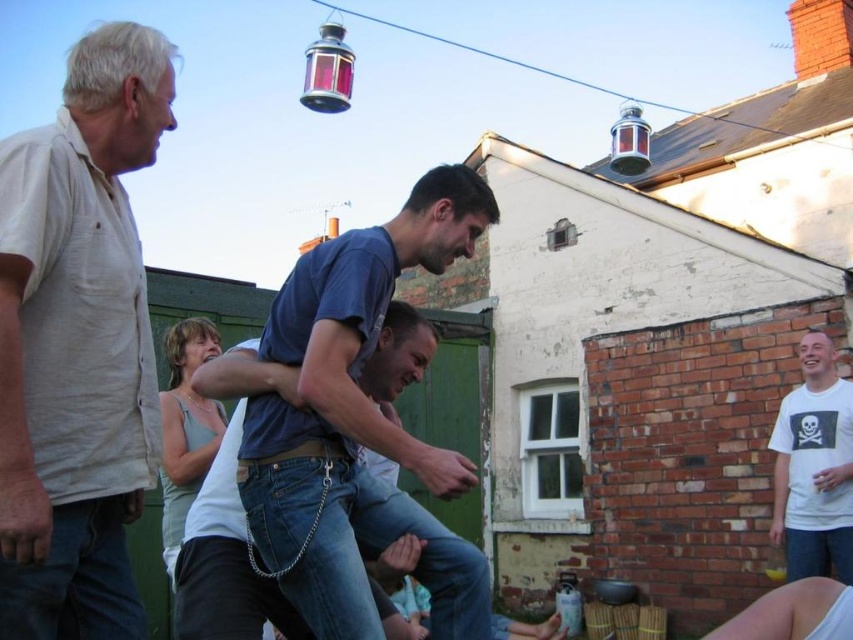
Question: Based on their relative distances, which object is farther from the jeans at left?

Choices:
 (A) jeans at center
 (B) denim jeans at lower right
 (C) blue denim jeans at center

Answer: (B)

Question: Considering the relative positions of jeans at center and white matte t-shirt at right in the image provided, where is jeans at center located with respect to white matte t-shirt at right?

Choices:
 (A) right
 (B) left

Answer: (B)

Question: Is blue denim jeans at center to the right of jeans at left from the viewer's perspective?

Choices:
 (A) yes
 (B) no

Answer: (A)

Question: In this image, where is light beige cotton shirt at left located relative to denim jeans at lower right?

Choices:
 (A) right
 (B) left

Answer: (B)

Question: Which of the following is the closest to the observer?

Choices:
 (A) blue denim jeans at center
 (B) jeans at center
 (C) light beige cotton shirt at left
 (D) jeans at left

Answer: (D)

Question: Which of the following is the closest to the observer?

Choices:
 (A) (68, 522)
 (B) (848, 576)
 (C) (825, 452)

Answer: (A)